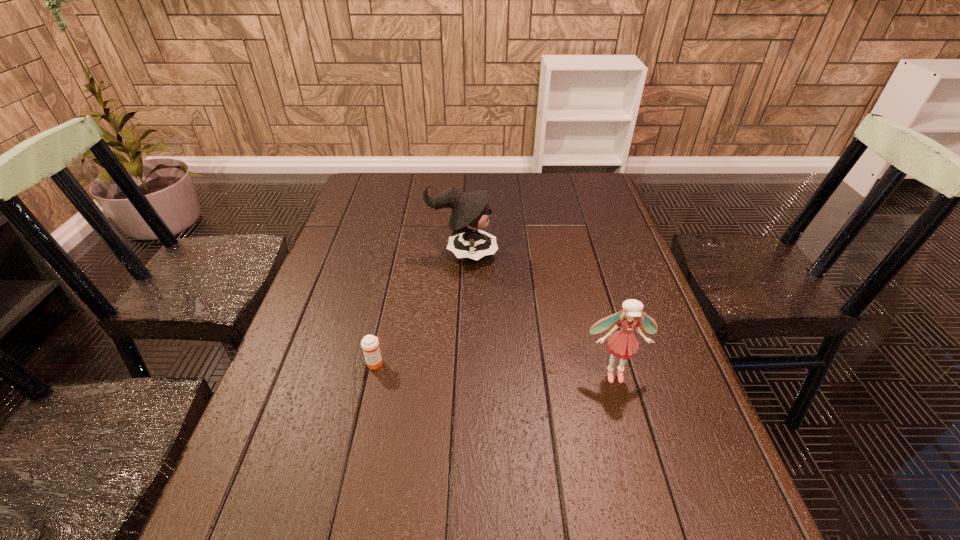
What are the coordinates of `free space at the far edge` in the screenshot? It's located at (511, 204).

You are a GUI agent. You are given a task and a screenshot of the screen. Output one action in this format:
    pyautogui.click(x=<x>, y=<y>)
    Task: Click on the vacant space at the left edge of the desktop
    This screenshot has height=540, width=960.
    Given the screenshot: What is the action you would take?
    pyautogui.click(x=249, y=440)

In the image, there is a desktop. Identify the location of vacant space at the right edge. Image resolution: width=960 pixels, height=540 pixels. (612, 286).

In the image, there is a desktop. Identify the location of vacant space at the far right corner. (604, 187).

This screenshot has height=540, width=960. I want to click on empty location between the medicine and the right doll, so [494, 368].

Where is `vacant area that lies between the nearer doll and the medicine`? vacant area that lies between the nearer doll and the medicine is located at coordinates (494, 368).

I want to click on empty space that is in between the farther doll and the rightmost object, so pos(539,314).

The width and height of the screenshot is (960, 540). Find the location of `free space between the second object from left to right and the medicine`. free space between the second object from left to right and the medicine is located at coordinates (419, 308).

Image resolution: width=960 pixels, height=540 pixels. In order to click on free area in between the rightmost object and the shortest object in this screenshot , I will do `click(494, 368)`.

Locate an element on the screen. vacant area that lies between the medicine and the rightmost object is located at coordinates (494, 368).